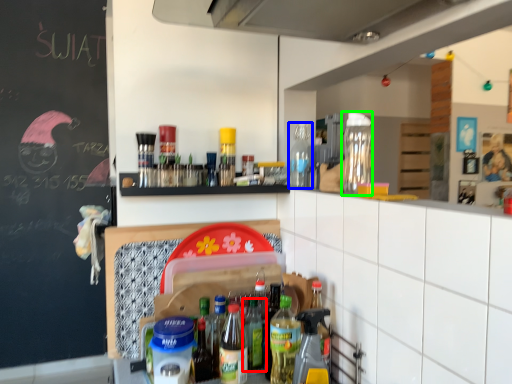
Question: Which object is the farthest from bottle (highlighted by a red box)? Choose among these: bottle (highlighted by a blue box) or bottle (highlighted by a green box).

Choices:
 (A) bottle
 (B) bottle

Answer: (B)